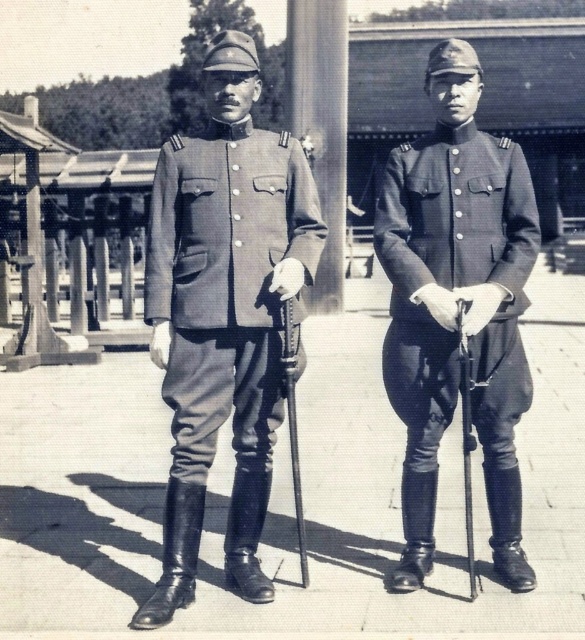
Question: Among these points, which one is farthest from the camera?

Choices:
 (A) (507, 336)
 (B) (243, 349)

Answer: (A)

Question: Is matte uniform at center wider than matte black uniform at center?

Choices:
 (A) yes
 (B) no

Answer: (A)

Question: Among these objects, which one is nearest to the camera?

Choices:
 (A) matte uniform at center
 (B) matte black uniform at center

Answer: (A)

Question: Can you confirm if matte uniform at center is bigger than matte black uniform at center?

Choices:
 (A) no
 (B) yes

Answer: (B)

Question: From the image, what is the correct spatial relationship of matte uniform at center in relation to matte black uniform at center?

Choices:
 (A) below
 (B) above

Answer: (A)